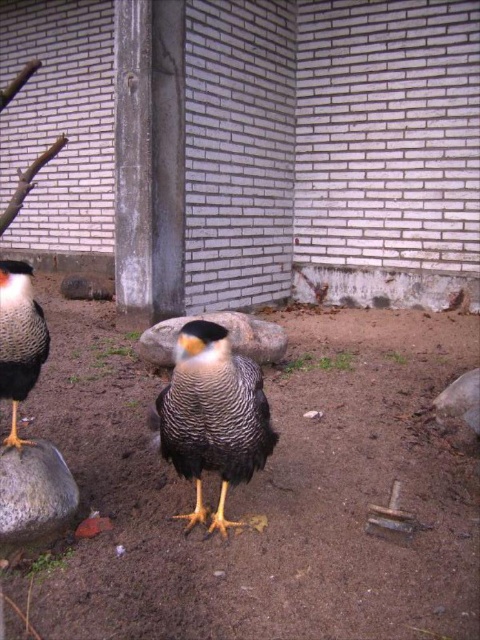
Is point (34, 525) less distant than point (48, 342)?

Yes.

Find the location of a particular element. The image size is (480, 640). gray smooth rock at lower left is located at coordinates (35, 492).

Is point (37, 497) positioned behind point (46, 355)?

No, it is not.

Identify the location of gray smooth rock at lower left. (35, 492).

Between point (206, 381) and point (152, 353), which one is positioned in front?

Point (206, 381) is more forward.

Who is positioned more to the left, speckled feathers bird at center or gray smooth rock at center?

Positioned to the left is gray smooth rock at center.

Does point (252, 428) come in front of point (242, 317)?

Yes, it is in front of point (242, 317).

I want to click on speckled feathers bird at center, so click(x=213, y=417).

Based on the photo, how far apart are speckled feathers bird at center and gray smooth rock at lower left?

speckled feathers bird at center is 45.86 centimeters from gray smooth rock at lower left.

Does speckled feathers bird at center have a greater height compared to gray smooth rock at lower left?

Correct, speckled feathers bird at center is much taller as gray smooth rock at lower left.

Does point (249, 460) come behind point (4, 477)?

No, it is not.

Locate an element on the screen. The image size is (480, 640). speckled feathers bird at center is located at coordinates (213, 417).